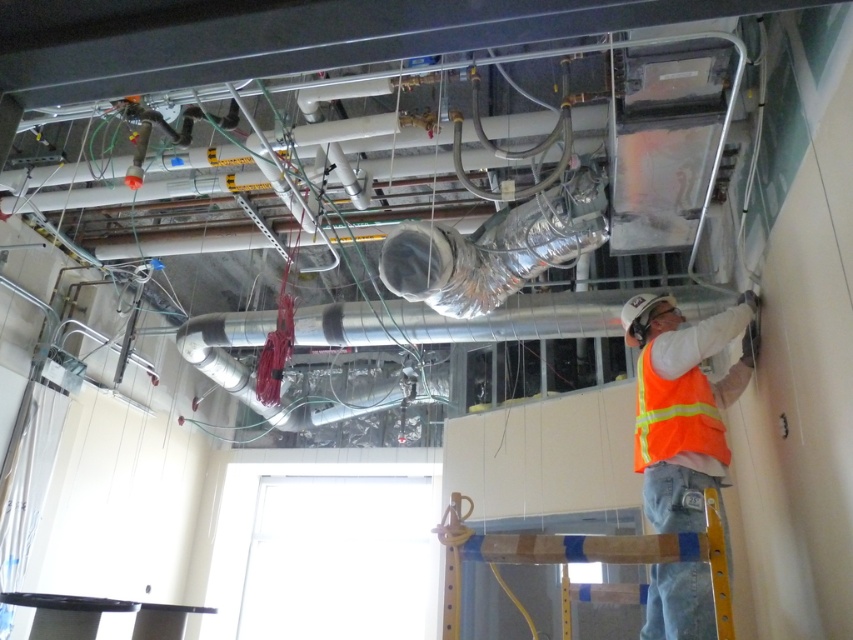
Can you confirm if orange reflective vest at center is positioned below wooden at lower right?

Actually, orange reflective vest at center is above wooden at lower right.

Who is positioned more to the right, orange reflective vest at center or wooden at lower right?

orange reflective vest at center is more to the right.

This screenshot has height=640, width=853. Identify the location of orange reflective vest at center. pos(683,401).

Identify the location of orange reflective vest at center. (683, 401).

Who is shorter, silver metallic duct at upper center or high visibility orange safety vest at lower right?

high visibility orange safety vest at lower right

Is silver metallic duct at upper center thinner than high visibility orange safety vest at lower right?

No.

This screenshot has height=640, width=853. Describe the element at coordinates (495, 248) in the screenshot. I see `silver metallic duct at upper center` at that location.

Where is `silver metallic duct at upper center`? This screenshot has height=640, width=853. silver metallic duct at upper center is located at coordinates (495, 248).

Does orange reflective vest at center have a greater height compared to wooden beam at center?

Yes.

Does point (697, 372) lie behind point (566, 556)?

Yes.

Measure the distance between orange reflective vest at center and camera.

The distance of orange reflective vest at center from camera is 1.84 meters.

Where is `orange reflective vest at center`? This screenshot has width=853, height=640. orange reflective vest at center is located at coordinates (683, 401).